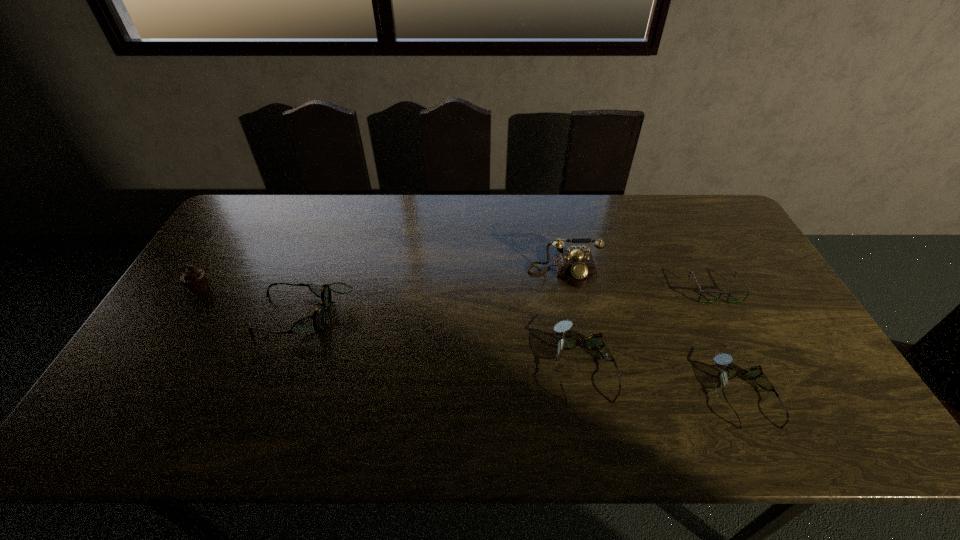
Locate an element on the screen. Image resolution: width=960 pixels, height=540 pixels. vacant region located on the back of the second tallest object is located at coordinates (245, 216).

You are a GUI agent. You are given a task and a screenshot of the screen. Output one action in this format:
    pyautogui.click(x=<x>, y=<y>)
    Task: Click on the object that is at the left edge
    The height and width of the screenshot is (540, 960).
    Given the screenshot: What is the action you would take?
    pyautogui.click(x=194, y=279)

Where is `object situated at the right edge`? The height and width of the screenshot is (540, 960). object situated at the right edge is located at coordinates point(748,292).

Find the location of a particular element. This screenshot has height=540, width=960. free space at the far edge is located at coordinates (383, 214).

At what (x,y) coordinates should I click in order to perform the action: click on free space at the near edge of the desktop. Please return your answer as a coordinate pair (x, y). The image size is (960, 540). Looking at the image, I should click on (310, 401).

The width and height of the screenshot is (960, 540). In the image, there is a desktop. Find the location of `vacant space at the left edge`. vacant space at the left edge is located at coordinates (165, 327).

Locate an element on the screen. The width and height of the screenshot is (960, 540). vacant position at the right edge of the desktop is located at coordinates (738, 246).

Find the location of a particular element. vacant space at the far right corner of the desktop is located at coordinates (691, 202).

At what (x,y) coordinates should I click in order to perform the action: click on empty location between the second spectacles from left to right and the telephone. Please return your answer as a coordinate pair (x, y). The image size is (960, 540). Looking at the image, I should click on (573, 318).

What are the coordinates of `empty space between the third spectacles from right to left and the telephone` in the screenshot? It's located at (573, 318).